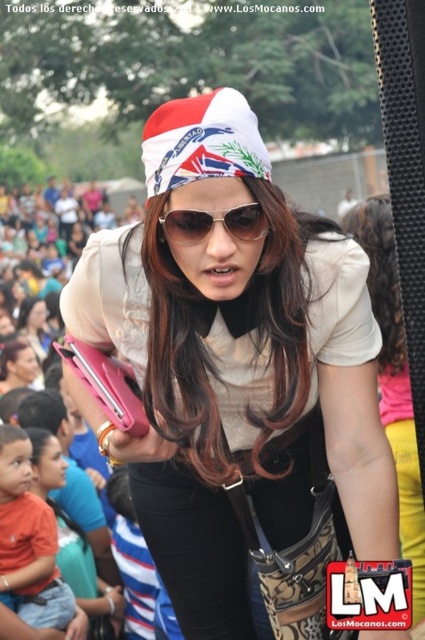
You are a photographer at the event and want to capture a closeup of the white matte bandana at center and the matte black phone at center. Which object should you zoom in on more to ensure both are in focus?

The white matte bandana at center is smaller than the matte black phone at center, so you should zoom in more on the white matte bandana at center to ensure both are in focus.

In the scene, there is a woman wearing a white matte bandana at center and sunglasses at center. Which object is shorter?

The white matte bandana at center is shorter than the sunglasses at center.

You are a photographer at the event and want to capture a closeup of both the white matte bandana at center and the sunglasses at center in the same frame. Given that your camera has a maximum focus range of 5 meters, will you be able to achieve this?

The white matte bandana at center and sunglasses at center are 5.10 meters apart, which exceeds the camera maximum focus range of 5 meters. Therefore, you cannot capture both in the same frame.